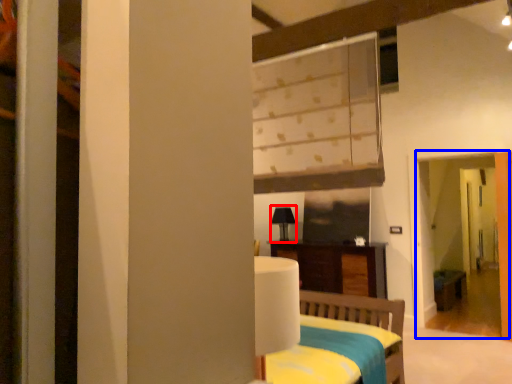
Question: Which object is further to the camera taking this photo, table lamp (highlighted by a red box) or screen door (highlighted by a blue box)?

Choices:
 (A) table lamp
 (B) screen door

Answer: (A)